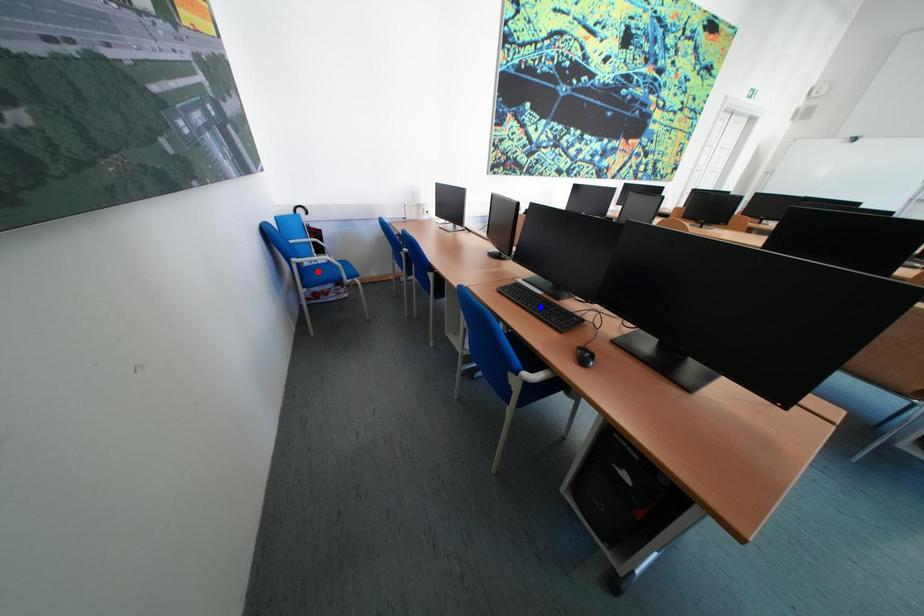
Question: Which of the two points in the image is closer to the camera?

Choices:
 (A) Blue point is closer.
 (B) Red point is closer.

Answer: (A)